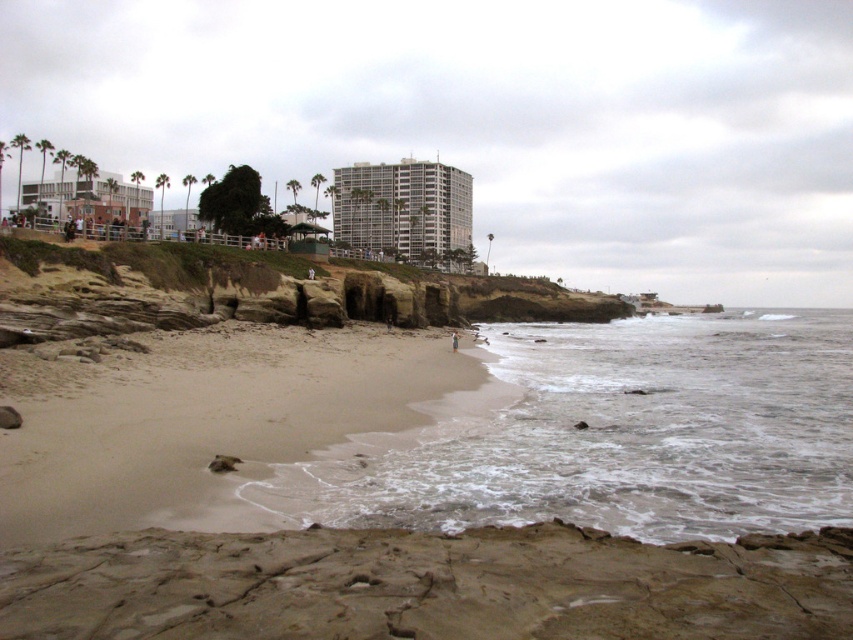
Question: Which object is the closest to the white foamy water at center?

Choices:
 (A) brown sandy beach at lower center
 (B) white brick building at left
 (C) sandy beach at lower left

Answer: (C)

Question: Which is nearer to the gray concrete building at center?

Choices:
 (A) sandy beach at lower left
 (B) white foamy water at center

Answer: (B)

Question: Considering the real-world distances, which object is farthest from the gray concrete building at center?

Choices:
 (A) white brick building at left
 (B) brown sandy beach at lower center

Answer: (B)

Question: Does white foamy water at center appear on the right side of gray concrete building at center?

Choices:
 (A) no
 (B) yes

Answer: (B)

Question: Where is gray concrete building at center located in relation to white brick building at left in the image?

Choices:
 (A) above
 (B) below

Answer: (B)

Question: Is white foamy water at center bigger than brown sandy beach at lower center?

Choices:
 (A) no
 (B) yes

Answer: (B)